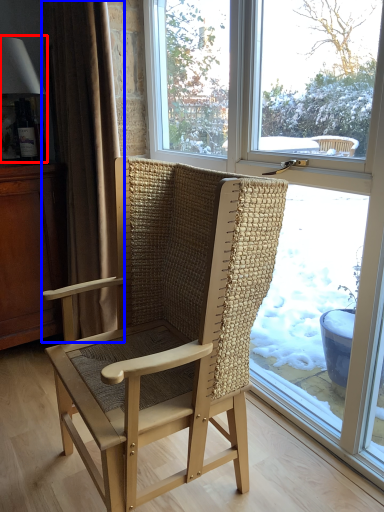
Question: Which point is closer to the camera, lamp (highlighted by a red box) or curtain (highlighted by a blue box)?

Choices:
 (A) lamp
 (B) curtain

Answer: (B)